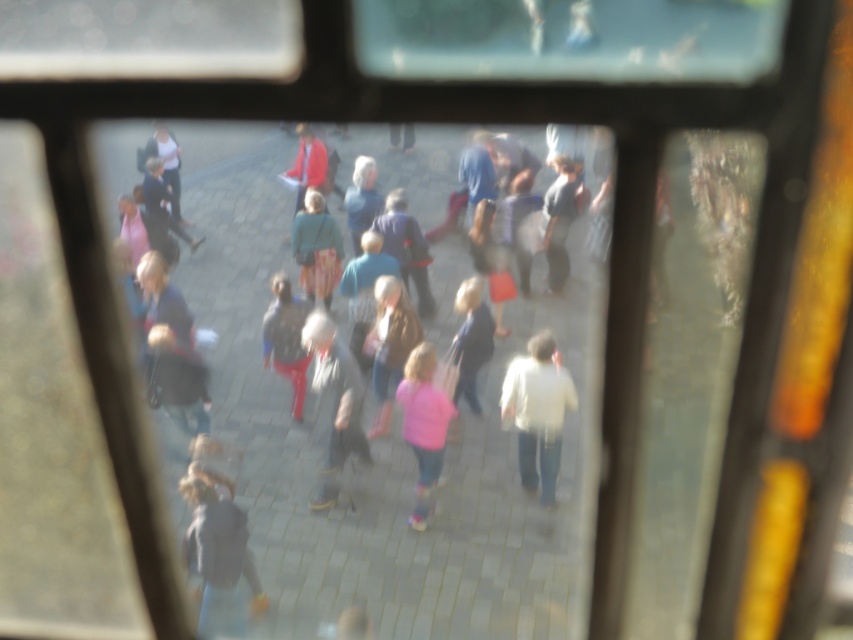
Between dark gray jacket at lower left and matte gray jacket at center, which one is positioned lower?

Positioned lower is dark gray jacket at lower left.

Is dark gray jacket at lower left above matte gray jacket at center?

Incorrect, dark gray jacket at lower left is not positioned above matte gray jacket at center.

Is point (236, 625) more distant than point (581, 166)?

Yes, point (236, 625) is behind point (581, 166).

Locate an element on the screen. This screenshot has height=640, width=853. dark gray jacket at lower left is located at coordinates (218, 556).

Which is more to the left, light pink fabric at center or dark blue jacket at upper left?

dark blue jacket at upper left is more to the left.

Find the location of a particular element. Image resolution: width=853 pixels, height=640 pixels. light pink fabric at center is located at coordinates (471, 339).

Which is more to the left, matte black jacket at center or light pink fabric at center?

Positioned to the left is matte black jacket at center.

Between matte black jacket at center and light pink fabric at center, which one has more height?

With more height is matte black jacket at center.

What do you see at coordinates (286, 339) in the screenshot? The height and width of the screenshot is (640, 853). I see `matte black jacket at center` at bounding box center [286, 339].

This screenshot has width=853, height=640. I want to click on matte black jacket at center, so click(x=286, y=339).